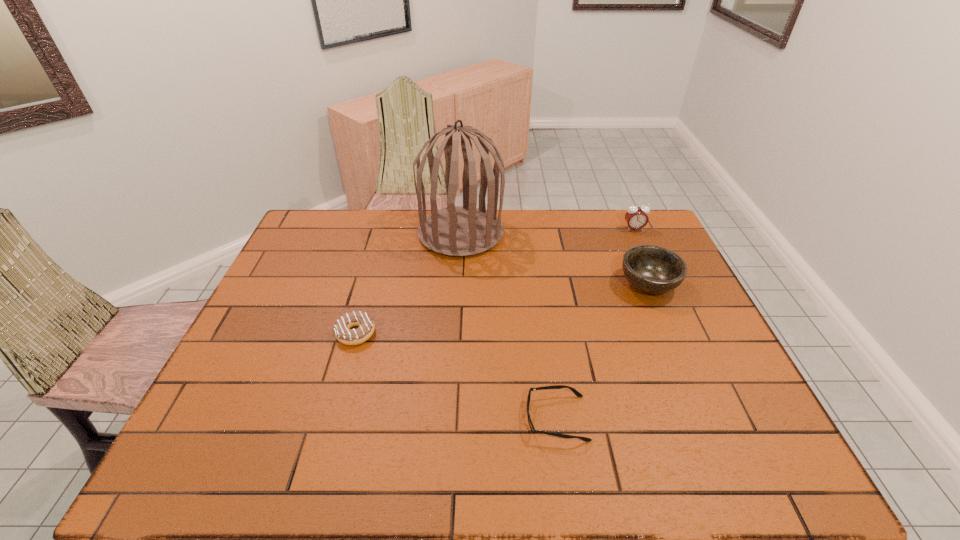
Identify the location of blank region between the alarm clock and the doughnut. (494, 281).

The width and height of the screenshot is (960, 540). I want to click on blank region between the birdcage and the doughnut, so click(x=408, y=283).

At what (x,y) coordinates should I click in order to perform the action: click on free area in between the second object from left to right and the spectacles. Please return your answer as a coordinate pair (x, y). The image size is (960, 540). Looking at the image, I should click on (509, 326).

Identify the location of vacant point located between the third tallest object and the spectacles. tap(602, 352).

Locate an element on the screen. free area in between the fourth object from right to left and the leftmost object is located at coordinates (408, 283).

Locate an element on the screen. The image size is (960, 540). vacant area that lies between the doughnut and the bowl is located at coordinates (502, 309).

Image resolution: width=960 pixels, height=540 pixels. In order to click on blank region between the alarm clock and the spectacles in this screenshot , I will do (x=595, y=323).

Locate which object ranks fourth in proximity to the birdcage. Please provide its 2D coordinates. Your answer should be formatted as a tuple, i.e. [(x, y)], where the tuple contains the x and y coordinates of a point satisfying the conditions above.

[(573, 390)]

Choose which object is the second nearest neighbor to the bowl. Please provide its 2D coordinates. Your answer should be formatted as a tuple, i.e. [(x, y)], where the tuple contains the x and y coordinates of a point satisfying the conditions above.

[(459, 231)]

Where is `free spot that satisfies the following two spatial constraints: 1. on the clock face of the second tallest object; 2. on the front-facing side of the nearest object`? This screenshot has width=960, height=540. free spot that satisfies the following two spatial constraints: 1. on the clock face of the second tallest object; 2. on the front-facing side of the nearest object is located at coordinates (720, 418).